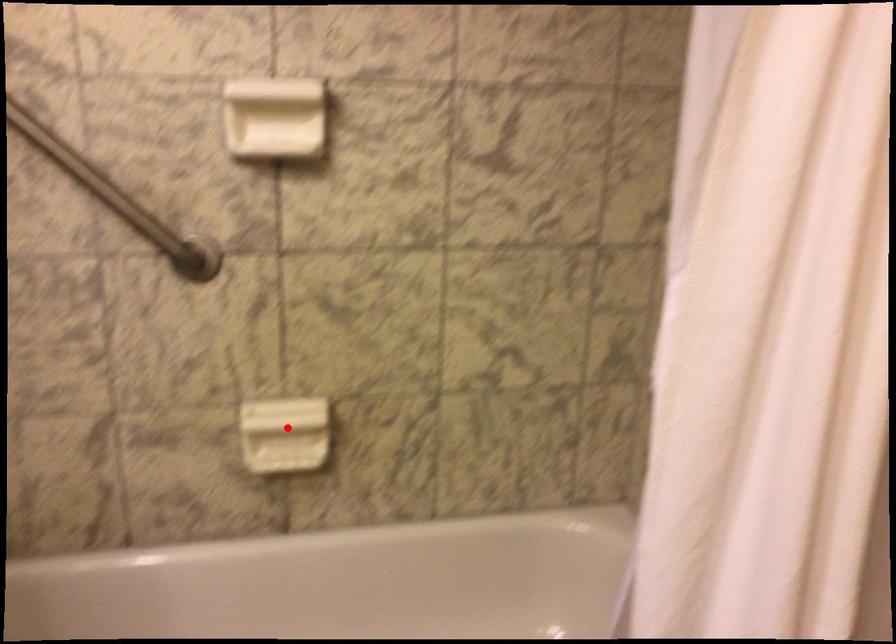
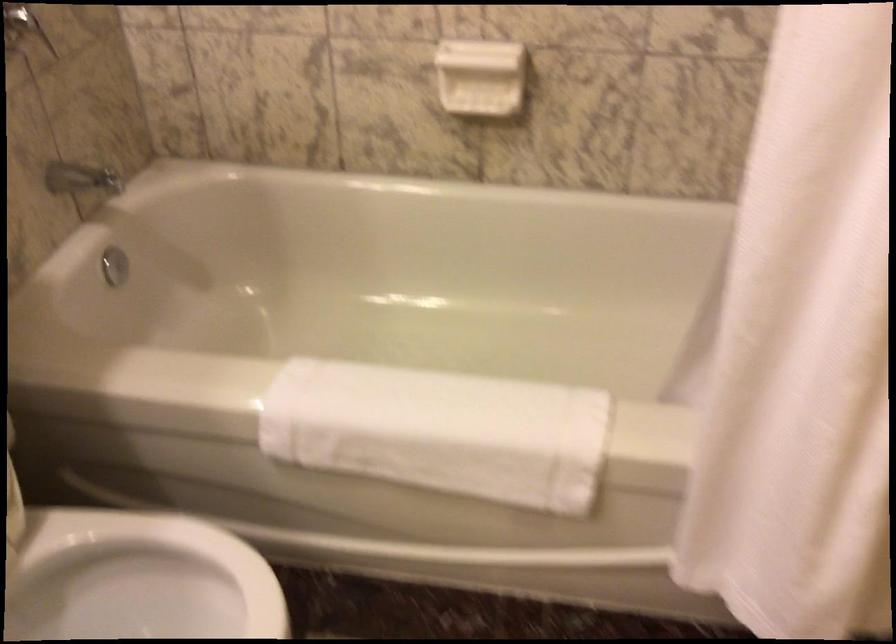
Locate, in the second image, the point that corresponds to the highlighted location in the first image.

(480, 77)